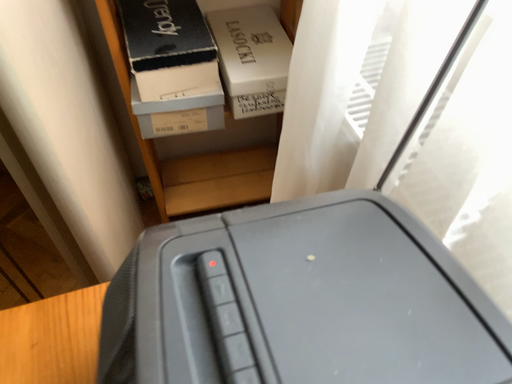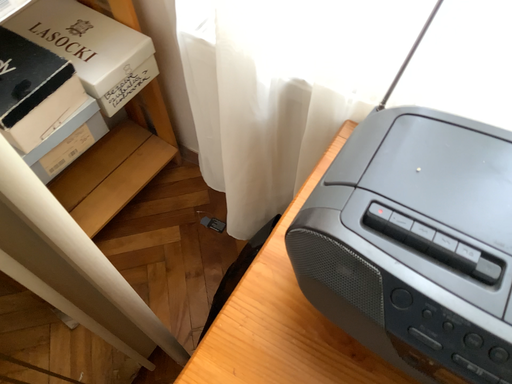
Question: Which way did the camera rotate in the video?

Choices:
 (A) rotated left
 (B) rotated right

Answer: (B)